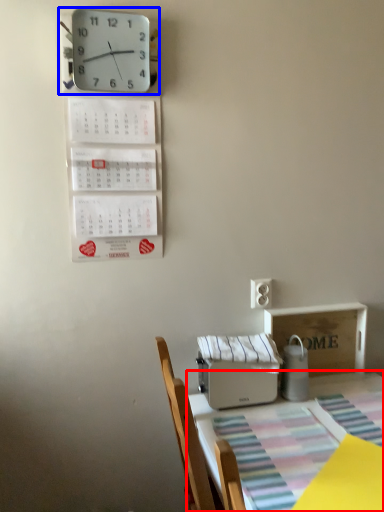
Question: Which object is further to the camera taking this photo, table (highlighted by a red box) or wall clock (highlighted by a blue box)?

Choices:
 (A) table
 (B) wall clock

Answer: (B)